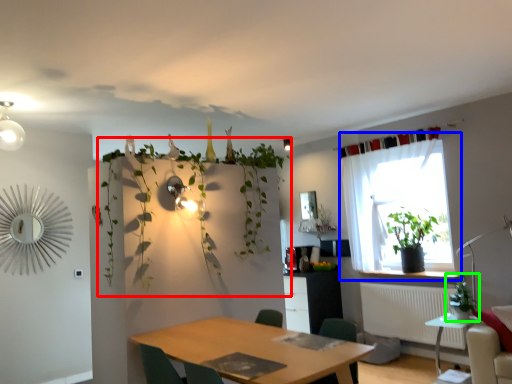
Question: Based on their relative distances, which object is nearer to vegetation (highlighted by a red box)? Choose from window (highlighted by a blue box) and houseplant (highlighted by a green box).

Choices:
 (A) window
 (B) houseplant

Answer: (A)